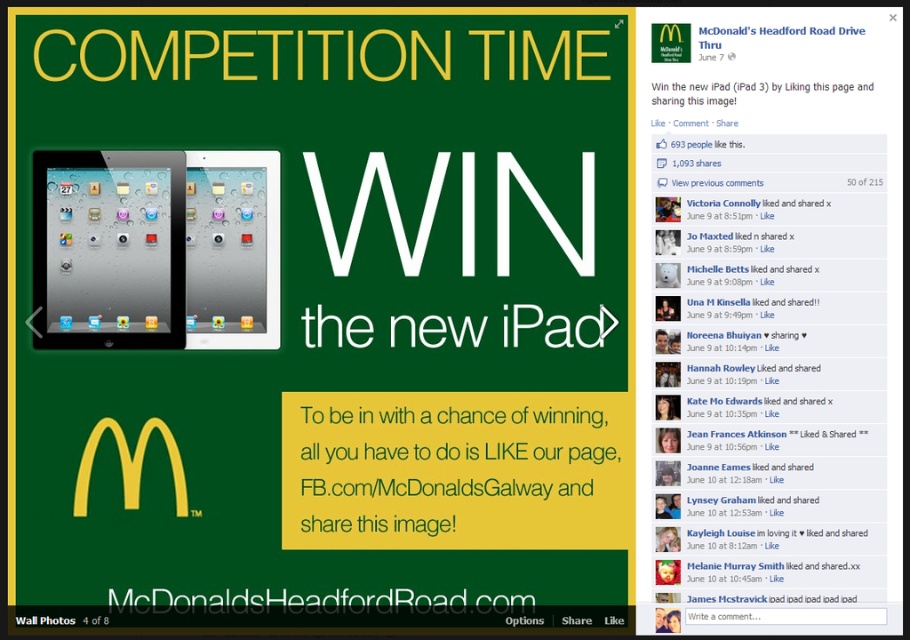
Question: Which of the following is the closest to the observer?

Choices:
 (A) (132, 176)
 (B) (372, 602)
 (C) (311, 493)
 (D) (349, 340)

Answer: (A)

Question: Considering the relative positions of black text at bottom and white paper at upper center in the image provided, where is black text at bottom located with respect to white paper at upper center?

Choices:
 (A) above
 (B) below

Answer: (B)

Question: Which object is closer to the camera taking this photo?

Choices:
 (A) white paper at upper center
 (B) satin black tablet at left

Answer: (B)

Question: In this image, where is white matte text at center located relative to white paper at upper center?

Choices:
 (A) left
 (B) right

Answer: (A)

Question: Is green paper at center smaller than satin black tablet at left?

Choices:
 (A) yes
 (B) no

Answer: (B)

Question: Considering the real-world distances, which object is farthest from the satin black tablet at left?

Choices:
 (A) black text at bottom
 (B) green paper at center
 (C) white paper at upper center

Answer: (C)